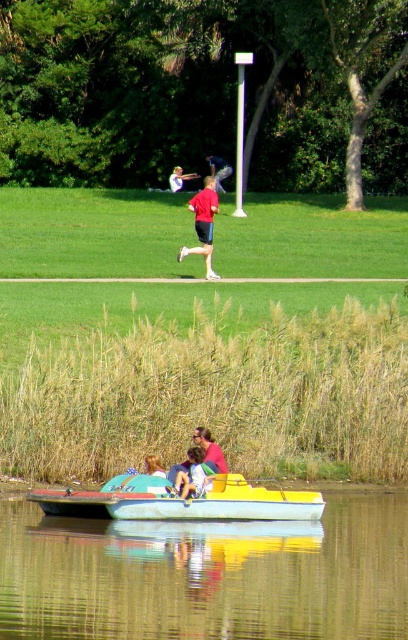
Question: Is yellow plastic boat at center thinner than light brown hair at center?

Choices:
 (A) yes
 (B) no

Answer: (B)

Question: Is smooth reflective water at lower center further to the viewer compared to red shirt at center?

Choices:
 (A) yes
 (B) no

Answer: (B)

Question: Which point is farther from the camera taking this photo?

Choices:
 (A) (215, 177)
 (B) (163, 467)
 (C) (33, 579)

Answer: (A)

Question: Does matte red shorts at center appear under red shirt at center?

Choices:
 (A) yes
 (B) no

Answer: (A)

Question: Which point is farther to the camera?

Choices:
 (A) red shirt at center
 (B) light brown hair at center
 (C) yellow plastic boat at center

Answer: (A)

Question: Which object is the farthest from the matte red shorts at center?

Choices:
 (A) light brown hair at center
 (B) yellow plastic boat at center
 (C) red shirt at center

Answer: (A)